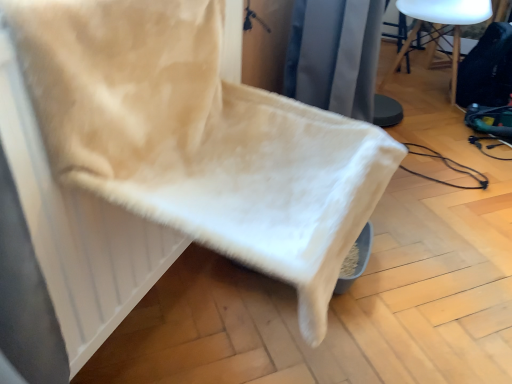
Question: Looking at the image, does white fluffy blanket at lower left seem bigger or smaller compared to black fabric chair at upper right?

Choices:
 (A) big
 (B) small

Answer: (B)

Question: From the image's perspective, is white fluffy blanket at lower left positioned above or below black fabric chair at upper right?

Choices:
 (A) above
 (B) below

Answer: (B)

Question: From a real-world perspective, relative to black fabric chair at upper right, is white fluffy blanket at lower left vertically above or below?

Choices:
 (A) above
 (B) below

Answer: (A)

Question: From a real-world perspective, is black fabric chair at upper right above or below white fluffy blanket at lower left?

Choices:
 (A) below
 (B) above

Answer: (A)

Question: In terms of size, does black fabric chair at upper right appear bigger or smaller than white fluffy blanket at lower left?

Choices:
 (A) big
 (B) small

Answer: (A)

Question: Choose the correct answer: Is black fabric chair at upper right inside white fluffy blanket at lower left or outside it?

Choices:
 (A) inside
 (B) outside

Answer: (B)

Question: Based on their positions, is black fabric chair at upper right located to the left or right of white fluffy blanket at lower left?

Choices:
 (A) left
 (B) right

Answer: (B)